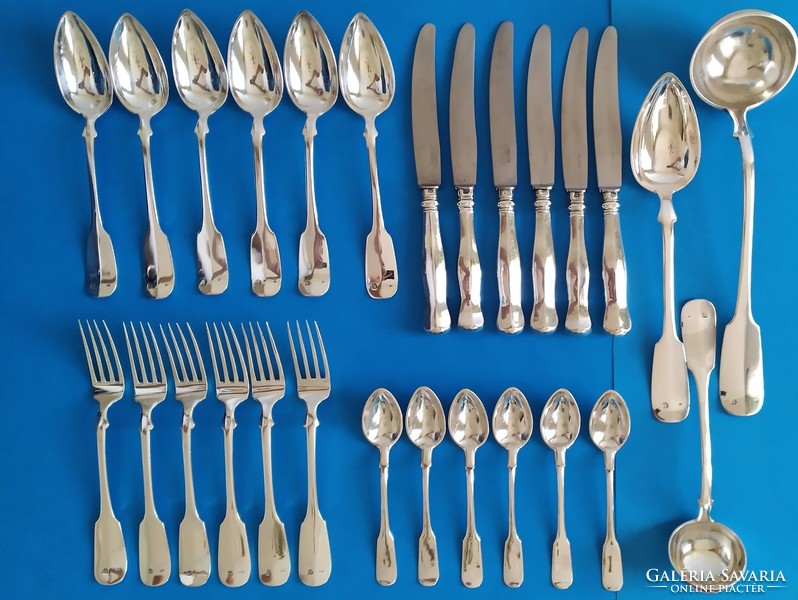
Where is `knives`? knives is located at coordinates (437, 292), (464, 289), (511, 289), (552, 295), (575, 292), (618, 298).